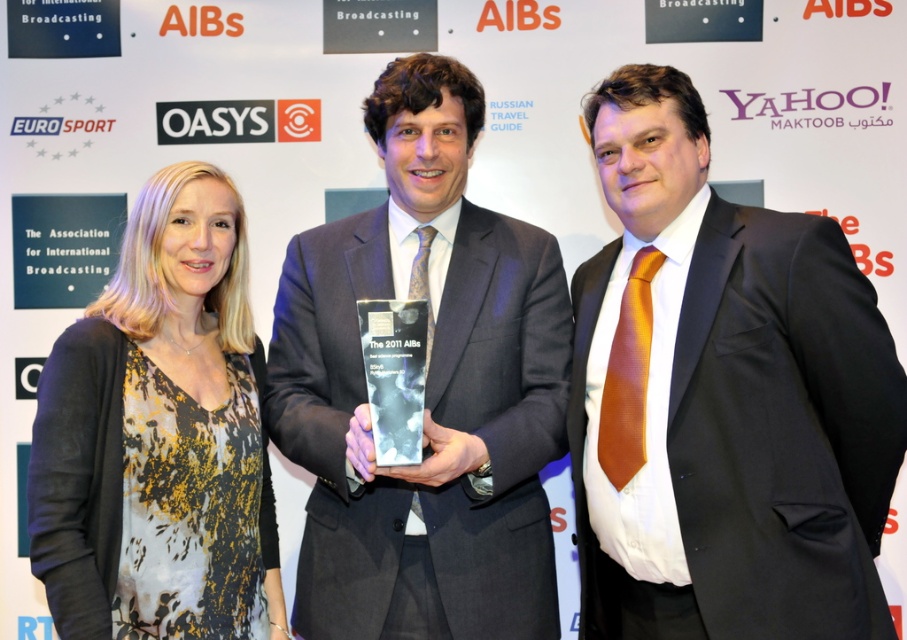
Which is below, matte black suit at center or printed silk blouse at left?

printed silk blouse at left is below.

Is point (466, 531) closer to viewer compared to point (184, 556)?

No, (466, 531) is behind (184, 556).

Which is behind, point (457, 145) or point (190, 296)?

Positioned behind is point (457, 145).

The height and width of the screenshot is (640, 907). Find the location of `matte black suit at center`. matte black suit at center is located at coordinates (425, 388).

Does black satin suit at center have a greater width compared to printed silk blouse at left?

Yes.

Does black satin suit at center have a lesser height compared to printed silk blouse at left?

Incorrect, black satin suit at center's height does not fall short of printed silk blouse at left's.

Image resolution: width=907 pixels, height=640 pixels. What do you see at coordinates (730, 396) in the screenshot? I see `black satin suit at center` at bounding box center [730, 396].

The image size is (907, 640). Find the location of `black satin suit at center`. black satin suit at center is located at coordinates (730, 396).

Looking at this image, can you confirm if black satin suit at center is smaller than matte black suit at center?

Incorrect, black satin suit at center is not smaller in size than matte black suit at center.

Which is above, black satin suit at center or matte black suit at center?

matte black suit at center is higher up.

Does point (901, 449) lie in front of point (537, 305)?

That is True.

Image resolution: width=907 pixels, height=640 pixels. I want to click on black satin suit at center, so pos(730,396).